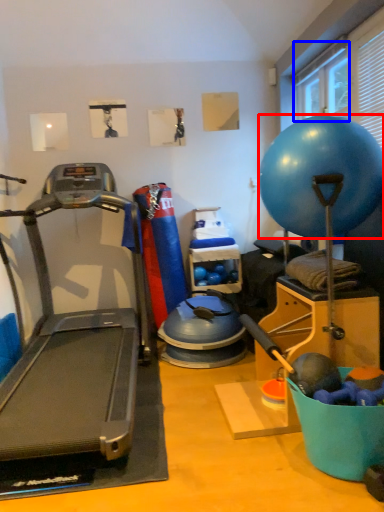
Question: Among these objects, which one is farthest to the camera, ball (highlighted by a red box) or window screen (highlighted by a blue box)?

Choices:
 (A) ball
 (B) window screen

Answer: (B)